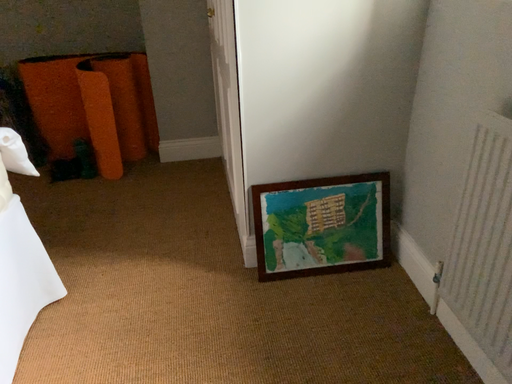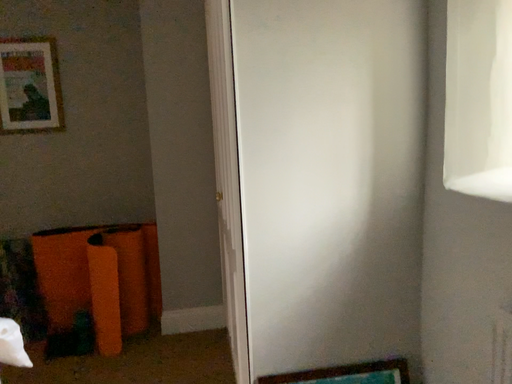
Question: How did the camera likely rotate when shooting the video?

Choices:
 (A) rotated downward
 (B) rotated upward

Answer: (B)